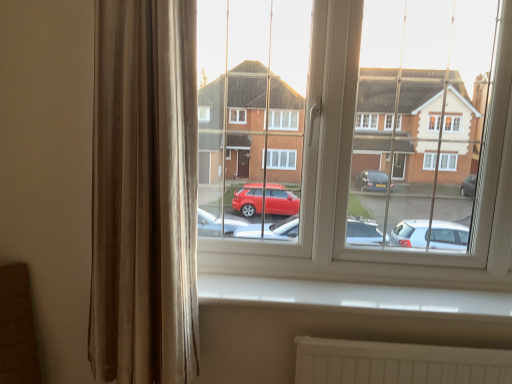
Question: From the image's perspective, does transparent glass window at center appear higher than white plastic window sill at lower center?

Choices:
 (A) yes
 (B) no

Answer: (A)

Question: Is transparent glass window at center to the left of white plastic window sill at lower center from the viewer's perspective?

Choices:
 (A) yes
 (B) no

Answer: (B)

Question: Is transparent glass window at center beside white plastic window sill at lower center?

Choices:
 (A) yes
 (B) no

Answer: (B)

Question: Can we say transparent glass window at center lies outside white plastic window sill at lower center?

Choices:
 (A) yes
 (B) no

Answer: (A)

Question: Does transparent glass window at center appear on the right side of white plastic window sill at lower center?

Choices:
 (A) no
 (B) yes

Answer: (B)

Question: From the image's perspective, would you say transparent glass window at center is shown under white plastic window sill at lower center?

Choices:
 (A) yes
 (B) no

Answer: (B)

Question: Is velvet beige curtain at left to the right of white plastic window sill at lower center from the viewer's perspective?

Choices:
 (A) no
 (B) yes

Answer: (A)

Question: Is velvet beige curtain at left smaller than white plastic window sill at lower center?

Choices:
 (A) yes
 (B) no

Answer: (B)

Question: Considering the relative sizes of velvet beige curtain at left and white plastic window sill at lower center in the image provided, is velvet beige curtain at left shorter than white plastic window sill at lower center?

Choices:
 (A) no
 (B) yes

Answer: (A)

Question: Is the position of velvet beige curtain at left more distant than that of white plastic window sill at lower center?

Choices:
 (A) no
 (B) yes

Answer: (A)

Question: Is velvet beige curtain at left facing away from white plastic window sill at lower center?

Choices:
 (A) yes
 (B) no

Answer: (B)

Question: Does velvet beige curtain at left turn towards white plastic window sill at lower center?

Choices:
 (A) no
 (B) yes

Answer: (A)

Question: Is transparent glass window at center a part of velvet beige curtain at left?

Choices:
 (A) no
 (B) yes

Answer: (A)